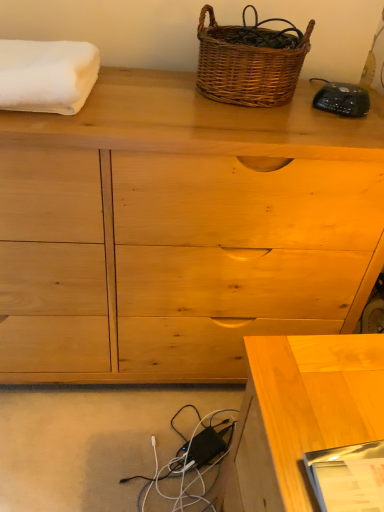
This screenshot has height=512, width=384. Describe the element at coordinates (180, 231) in the screenshot. I see `natural wood chest of drawers at center` at that location.

Measure the distance between point (9, 46) and camera.

34.37 inches.

Locate an element on the screen. The image size is (384, 512). light wood desk at lower right is located at coordinates (301, 414).

You are a GUI agent. You are given a task and a screenshot of the screen. Output one action in this format:
    pyautogui.click(x=<x>, y=<y>)
    Task: Click on the black plastic remote at upper right
    The width and height of the screenshot is (384, 512).
    Given the screenshot: What is the action you would take?
    pyautogui.click(x=342, y=99)

At what (x,y) coordinates should I click in order to perform the action: click on natural wood chest of drawers at center. Please return your answer as a coordinate pair (x, y). Looking at the image, I should click on (180, 231).

Based on the photo, is white fluffy towel at upper left turned away from black plastic remote at upper right?

No, white fluffy towel at upper left is not facing away from black plastic remote at upper right.

Considering the relative sizes of white fluffy towel at upper left and black plastic remote at upper right in the image provided, is white fluffy towel at upper left thinner than black plastic remote at upper right?

Incorrect, the width of white fluffy towel at upper left is not less than that of black plastic remote at upper right.

Measure the distance between white fluffy towel at upper left and black plastic remote at upper right.

white fluffy towel at upper left is 22.45 inches from black plastic remote at upper right.

From a real-world perspective, is natural wood chest of drawers at center physically above black plastic remote at upper right?

Incorrect, from a real-world perspective, natural wood chest of drawers at center is lower than black plastic remote at upper right.

Which is behind, point (234, 112) or point (347, 87)?

Point (347, 87)

Is natural wood chest of drawers at center directly adjacent to black plastic remote at upper right?

No, natural wood chest of drawers at center is not next to black plastic remote at upper right.

Does natural wood chest of drawers at center come in front of black plastic remote at upper right?

That is True.

How different are the orientations of light wood desk at lower right and white fluffy towel at upper left in degrees?

The facing directions of light wood desk at lower right and white fluffy towel at upper left are 87.7 degrees apart.

From a real-world perspective, does light wood desk at lower right sit lower than white fluffy towel at upper left?

Indeed, from a real-world perspective, light wood desk at lower right is positioned beneath white fluffy towel at upper left.

Is point (261, 340) closer to viewer compared to point (49, 42)?

Yes, point (261, 340) is in front of point (49, 42).

From the image's perspective, which object appears higher, white fluffy towel at upper left or natural wood chest of drawers at center?

white fluffy towel at upper left is shown above in the image.

Identify the location of bath towel above the natural wood chest of drawers at center (from a real-world perspective). (47, 75).

Is white fluffy towel at upper left oriented towards natural wood chest of drawers at center?

No, white fluffy towel at upper left is not aimed at natural wood chest of drawers at center.

Does point (250, 78) come behind point (79, 174)?

Yes.

From the image's perspective, which one is positioned higher, woven brown picnic basket at upper center or natural wood chest of drawers at center?

woven brown picnic basket at upper center, from the image's perspective.

Can you see woven brown picnic basket at upper center touching natural wood chest of drawers at center?

No, woven brown picnic basket at upper center is not in contact with natural wood chest of drawers at center.

Identify the location of the chest of drawers below the woven brown picnic basket at upper center (from the image's perspective). The height and width of the screenshot is (512, 384). (180, 231).

Is natural wood chest of drawers at center positioned behind woven brown picnic basket at upper center?

No, it is in front of woven brown picnic basket at upper center.

Is natural wood chest of drawers at center oriented away from woven brown picnic basket at upper center?

No, natural wood chest of drawers at center is not facing the opposite direction of woven brown picnic basket at upper center.

Between point (304, 200) and point (236, 100), which one is positioned behind?

Positioned behind is point (236, 100).

Does light wood desk at lower right turn towards natural wood chest of drawers at center?

No, light wood desk at lower right is not turned towards natural wood chest of drawers at center.

From the image's perspective, is light wood desk at lower right under natural wood chest of drawers at center?

Yes.

Does light wood desk at lower right have a greater width compared to natural wood chest of drawers at center?

Incorrect, the width of light wood desk at lower right does not surpass that of natural wood chest of drawers at center.

This screenshot has width=384, height=512. I want to click on bath towel in front of the black plastic remote at upper right, so click(x=47, y=75).

Locate an element on the screen. This screenshot has height=512, width=384. gadget above the natural wood chest of drawers at center (from a real-world perspective) is located at coordinates (342, 99).

Based on their spatial positions, is black plastic remote at upper right or white fluffy towel at upper left closer to woven brown picnic basket at upper center?

black plastic remote at upper right lies closer to woven brown picnic basket at upper center than the other object.

Based on their spatial positions, is black plastic remote at upper right or natural wood chest of drawers at center closer to woven brown picnic basket at upper center?

black plastic remote at upper right.

Looking at the image, which one is located further to light wood desk at lower right, white fluffy towel at upper left or black plastic remote at upper right?

white fluffy towel at upper left is positioned further to the anchor light wood desk at lower right.

In the scene shown: Which object lies further to the anchor point black plastic remote at upper right, light wood desk at lower right or natural wood chest of drawers at center?

Among the two, light wood desk at lower right is located further to black plastic remote at upper right.

From the image, which object appears to be nearer to light wood desk at lower right, black plastic remote at upper right or natural wood chest of drawers at center?

The object closer to light wood desk at lower right is natural wood chest of drawers at center.

Based on their spatial positions, is white fluffy towel at upper left or light wood desk at lower right closer to black plastic remote at upper right?

white fluffy towel at upper left is closer to black plastic remote at upper right.

When comparing their distances from light wood desk at lower right, does woven brown picnic basket at upper center or white fluffy towel at upper left seem closer?

woven brown picnic basket at upper center lies closer to light wood desk at lower right than the other object.

Considering their positions, is white fluffy towel at upper left positioned further to woven brown picnic basket at upper center than light wood desk at lower right?

light wood desk at lower right.

You are a GUI agent. You are given a task and a screenshot of the screen. Output one action in this format:
    pyautogui.click(x=<x>, y=<y>)
    Task: Click on the chest of drawers between white fluffy towel at upper left and black plastic remote at upper right
    
    Given the screenshot: What is the action you would take?
    pyautogui.click(x=180, y=231)

Where is `picnic basket between white fluffy towel at upper left and black plastic remote at upper right in the horizontal direction`? The height and width of the screenshot is (512, 384). picnic basket between white fluffy towel at upper left and black plastic remote at upper right in the horizontal direction is located at coordinates (248, 64).

Where is `chest of drawers between white fluffy towel at upper left and light wood desk at lower right in the vertical direction`? chest of drawers between white fluffy towel at upper left and light wood desk at lower right in the vertical direction is located at coordinates (180, 231).

The height and width of the screenshot is (512, 384). I want to click on gadget that lies between woven brown picnic basket at upper center and light wood desk at lower right from top to bottom, so click(342, 99).